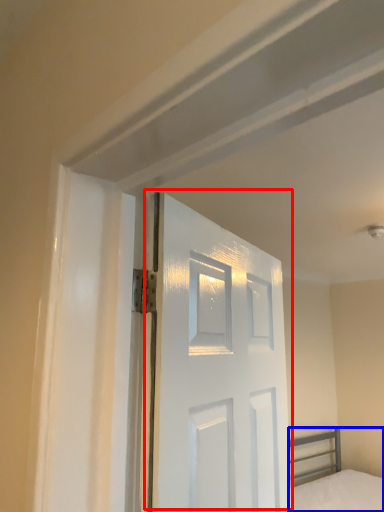
Question: Which object is closer to the camera taking this photo, door (highlighted by a red box) or bed (highlighted by a blue box)?

Choices:
 (A) door
 (B) bed

Answer: (A)